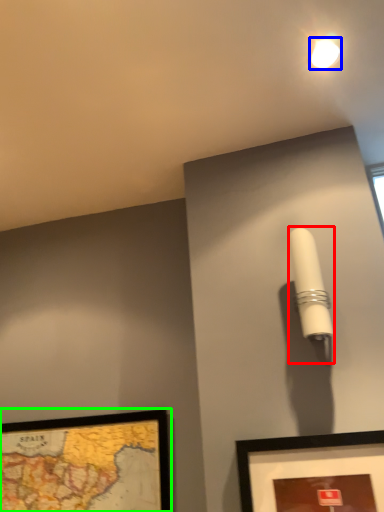
Question: Which is nearer to the table lamp (highlighted by a red box)? droplight (highlighted by a blue box) or picture frame (highlighted by a green box).

Choices:
 (A) droplight
 (B) picture frame

Answer: (A)